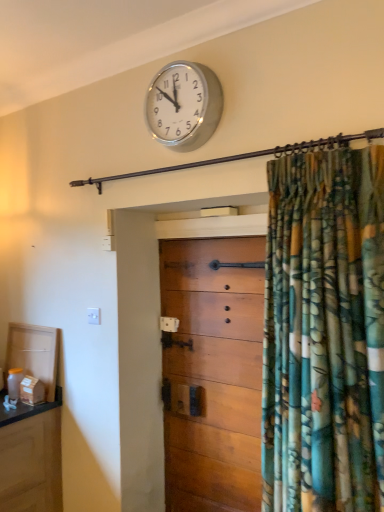
Question: Based on their sizes in the image, would you say wooden chest of drawers at center is bigger or smaller than silver metallic clock at upper center?

Choices:
 (A) small
 (B) big

Answer: (B)

Question: Considering the positions of point (198, 368) and point (208, 125), is point (198, 368) closer or farther from the camera than point (208, 125)?

Choices:
 (A) farther
 (B) closer

Answer: (A)

Question: From the image's perspective, is wooden chest of drawers at center located above or below silver metallic clock at upper center?

Choices:
 (A) below
 (B) above

Answer: (A)

Question: From a real-world perspective, is silver metallic clock at upper center positioned above or below wooden chest of drawers at center?

Choices:
 (A) below
 (B) above

Answer: (B)

Question: Considering the positions of silver metallic clock at upper center and wooden chest of drawers at center in the image, is silver metallic clock at upper center taller or shorter than wooden chest of drawers at center?

Choices:
 (A) short
 (B) tall

Answer: (A)

Question: Considering their positions, is silver metallic clock at upper center located in front of or behind wooden chest of drawers at center?

Choices:
 (A) behind
 (B) front

Answer: (B)

Question: In the image, is silver metallic clock at upper center on the left side or the right side of wooden chest of drawers at center?

Choices:
 (A) left
 (B) right

Answer: (A)